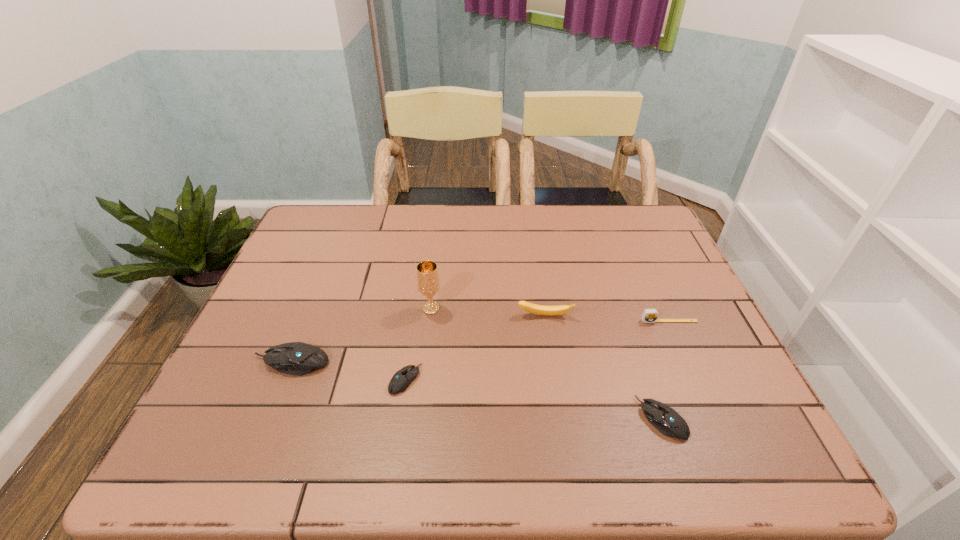
If equal spacing is the goal by inserting an additional mouse_(computer_equipment) among them, please point out a vacant space for this new mouse_(computer_equipment). Please provide its 2D coordinates. Your answer should be formatted as a tuple, i.e. [(x, y)], where the tuple contains the x and y coordinates of a point satisfying the conditions above.

[(529, 399)]